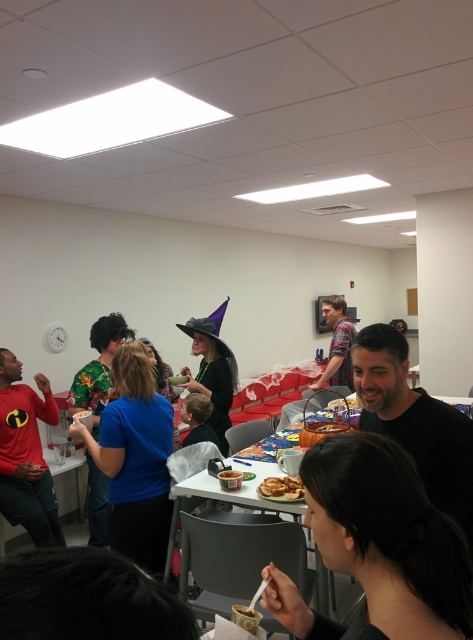
You are a guest at the party and want to grab the golden crispy sandwich at center without touching the plaid shirt at center. Is this possible?

The plaid shirt at center is much taller than the golden crispy sandwich at center, so the sandwich is below the shirt. You can reach the golden crispy sandwich at center by moving around the plaid shirt at center to avoid contact.

From the picture: You are at a party and notice two people wearing shirts at the center of the image. Which shirt is closer to you, the blue fabric shirt at center or the floral fabric shirt at center?

The blue fabric shirt at center is closer to you because it is in front of the floral fabric shirt at center.